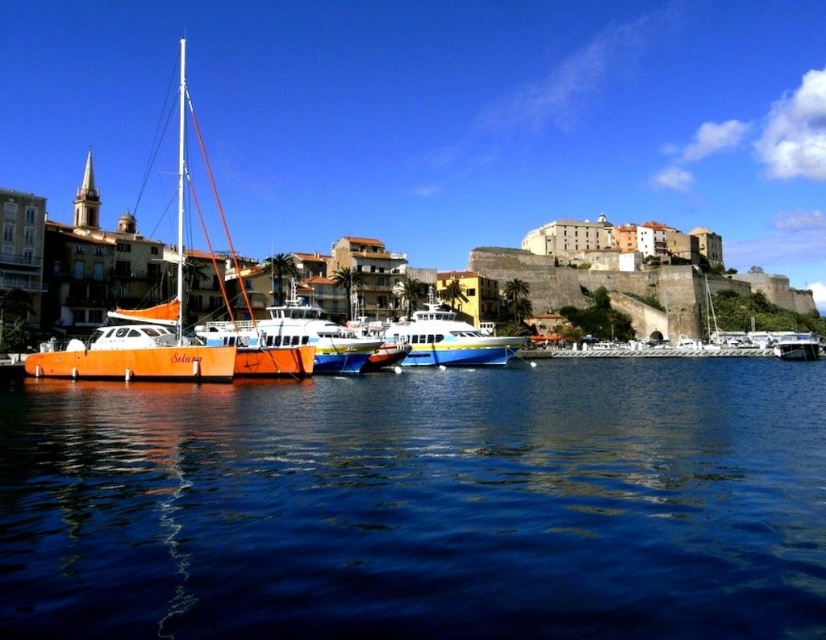
Question: Can you confirm if blue liquid water at lower center is smaller than blue glossy boat at center?

Choices:
 (A) no
 (B) yes

Answer: (A)

Question: Does blue liquid water at lower center appear on the left side of blue glossy boat at center?

Choices:
 (A) no
 (B) yes

Answer: (B)

Question: Which of the following is the closest to the observer?

Choices:
 (A) (390, 326)
 (B) (179, 188)
 (C) (89, 230)

Answer: (A)

Question: Which point appears farthest from the camera in this image?

Choices:
 (A) [x=413, y=506]
 (B) [x=582, y=284]
 (C) [x=292, y=342]

Answer: (B)

Question: Is orange matte sailboat at left bigger than blue glossy boat at center?

Choices:
 (A) yes
 (B) no

Answer: (A)

Question: Among these points, which one is nearest to the camera?

Choices:
 (A) (146, 282)
 (B) (402, 333)
 (C) (188, 182)

Answer: (A)